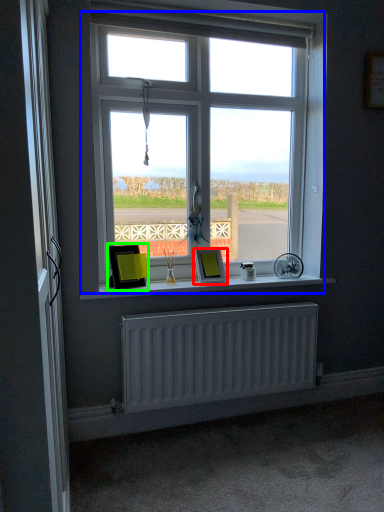
Question: Considering the real-world distances, which object is farthest from picture frame (highlighted by a red box)? window (highlighted by a blue box) or picture frame (highlighted by a green box)?

Choices:
 (A) window
 (B) picture frame

Answer: (A)